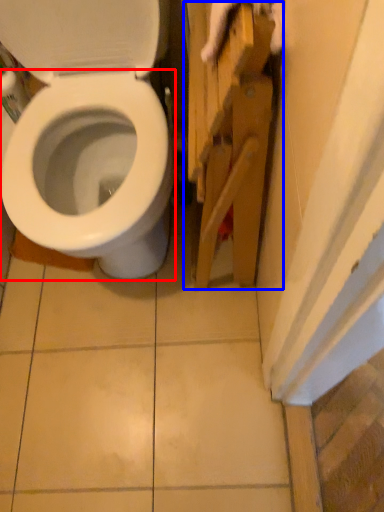
Question: Which object is closer to the camera taking this photo, bidet (highlighted by a red box) or cabinetry (highlighted by a blue box)?

Choices:
 (A) bidet
 (B) cabinetry

Answer: (A)